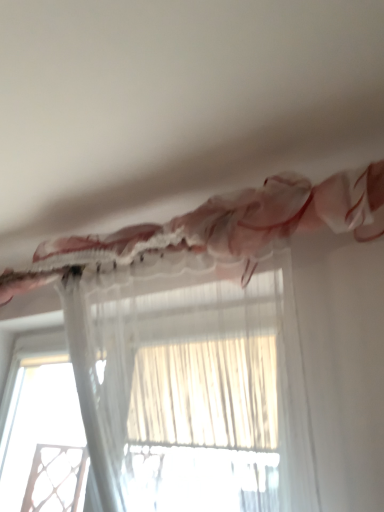
Question: Does translucent sheer curtain at upper center, the second curtain ordered from the bottom, come in front of transparent fabric at lower left?

Choices:
 (A) no
 (B) yes

Answer: (B)

Question: Can you confirm if translucent sheer curtain at upper center, the second curtain ordered from the bottom, is positioned to the left of transparent fabric at lower left?

Choices:
 (A) no
 (B) yes

Answer: (A)

Question: Is translucent sheer curtain at upper center, the 1th curtain viewed from the top, looking in the opposite direction of transparent fabric at lower left?

Choices:
 (A) no
 (B) yes

Answer: (A)

Question: Considering the relative sizes of translucent sheer curtain at upper center, the 1th curtain viewed from the top, and transparent fabric at lower left in the image provided, is translucent sheer curtain at upper center, the 1th curtain viewed from the top, taller than transparent fabric at lower left?

Choices:
 (A) yes
 (B) no

Answer: (B)

Question: From the image's perspective, is translucent sheer curtain at upper center, the second curtain ordered from the bottom, below transparent fabric at lower left?

Choices:
 (A) no
 (B) yes

Answer: (A)

Question: Considering the relative sizes of translucent sheer curtain at upper center, the second curtain ordered from the bottom, and transparent fabric at lower left in the image provided, is translucent sheer curtain at upper center, the second curtain ordered from the bottom, thinner than transparent fabric at lower left?

Choices:
 (A) no
 (B) yes

Answer: (A)

Question: From the image's perspective, is translucent sheer curtain at upper center, the second curtain ordered from the bottom, on top of translucent sheer curtain at upper center, which is counted as the second curtain, starting from the top?

Choices:
 (A) yes
 (B) no

Answer: (A)

Question: Is translucent sheer curtain at upper center, the 1th curtain viewed from the top, looking in the opposite direction of translucent sheer curtain at upper center, which is counted as the second curtain, starting from the top?

Choices:
 (A) yes
 (B) no

Answer: (A)

Question: Is translucent sheer curtain at upper center, the 1th curtain viewed from the top, facing towards translucent sheer curtain at upper center, which is counted as the second curtain, starting from the top?

Choices:
 (A) yes
 (B) no

Answer: (A)

Question: From a real-world perspective, is translucent sheer curtain at upper center, the second curtain ordered from the bottom, over translucent sheer curtain at upper center, which is counted as the second curtain, starting from the top?

Choices:
 (A) yes
 (B) no

Answer: (A)

Question: Is translucent sheer curtain at upper center, the second curtain ordered from the bottom, surrounding translucent sheer curtain at upper center, which is counted as the second curtain, starting from the top?

Choices:
 (A) yes
 (B) no

Answer: (A)

Question: From a real-world perspective, is translucent sheer curtain at upper center, the second curtain ordered from the bottom, located beneath translucent sheer curtain at upper center, which is counted as the second curtain, starting from the top?

Choices:
 (A) yes
 (B) no

Answer: (B)

Question: Is transparent fabric at lower left at the left side of translucent sheer curtain at upper center, marked as the 1th curtain in a bottom-to-top arrangement?

Choices:
 (A) yes
 (B) no

Answer: (A)